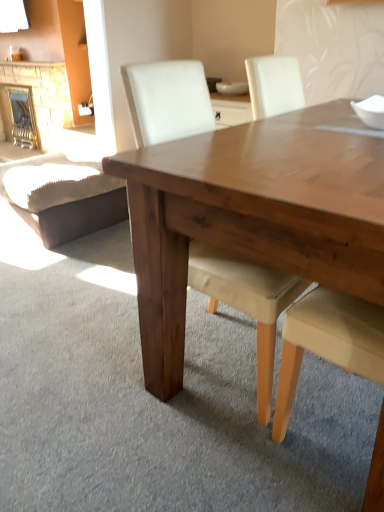
Find the location of a particular element. Image resolution: width=384 pixels, height=512 pixels. free space that is to the left of white glossy bowl at upper right, acting as the second bowl starting from the back is located at coordinates (343, 136).